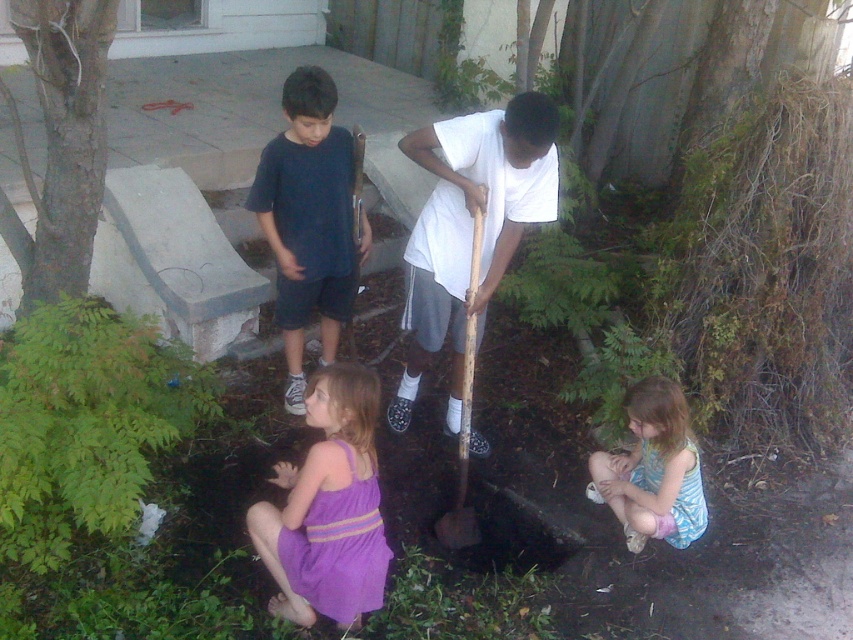
Which is above, smooth bark tree at left or wooden shovel at center?

smooth bark tree at left is higher up.

Does smooth bark tree at left have a lesser height compared to wooden shovel at center?

Yes, smooth bark tree at left is shorter than wooden shovel at center.

Is point (91, 157) farther from viewer compared to point (440, 531)?

No, it is in front of (440, 531).

I want to click on smooth bark tree at left, so click(x=62, y=141).

Which is below, purple satin dress at lower center or dark blue t-shirt at center?

Positioned lower is purple satin dress at lower center.

Does purple satin dress at lower center have a lesser width compared to dark blue t-shirt at center?

Indeed, purple satin dress at lower center has a lesser width compared to dark blue t-shirt at center.

What are the coordinates of `purple satin dress at lower center` in the screenshot? It's located at (328, 508).

Does green leafy plant at lower left come in front of purple satin dress at lower center?

Yes, green leafy plant at lower left is in front of purple satin dress at lower center.

Who is more distant from viewer, [86,444] or [294,545]?

Point [86,444]

Identify the location of green leafy plant at lower left. This screenshot has width=853, height=640. (86, 422).